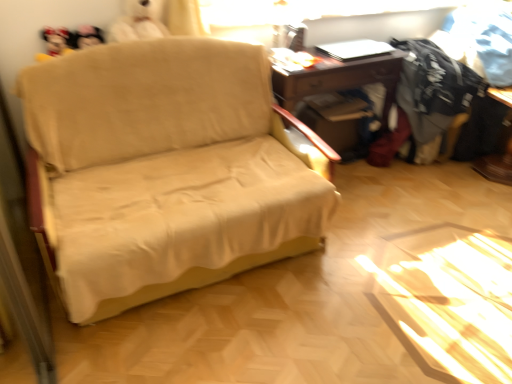
You are a GUI agent. You are given a task and a screenshot of the screen. Output one action in this format:
    pyautogui.click(x=<x>, y=<y>)
    Task: Click on the unoccupied region to the right of beige fabric couch at center
    
    Given the screenshot: What is the action you would take?
    pyautogui.click(x=400, y=256)